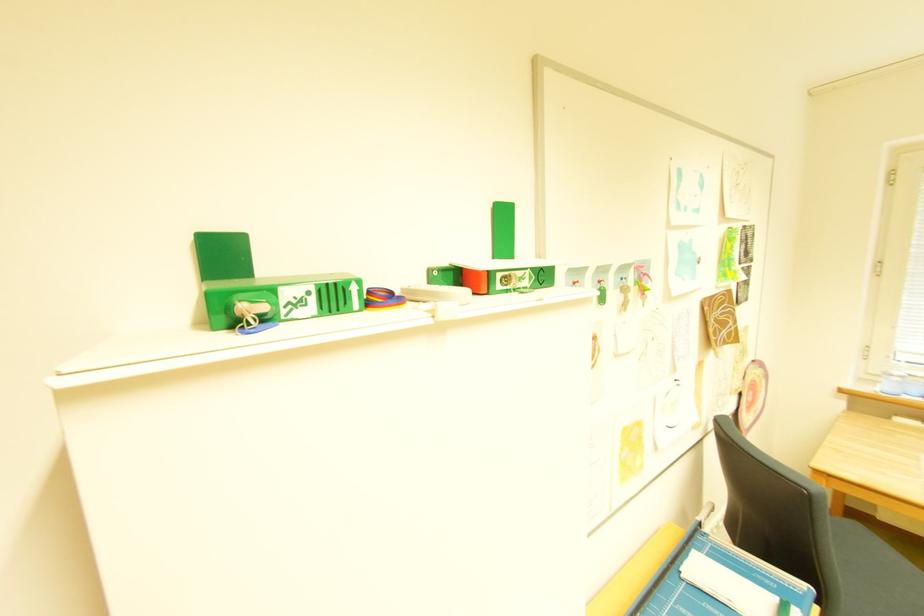
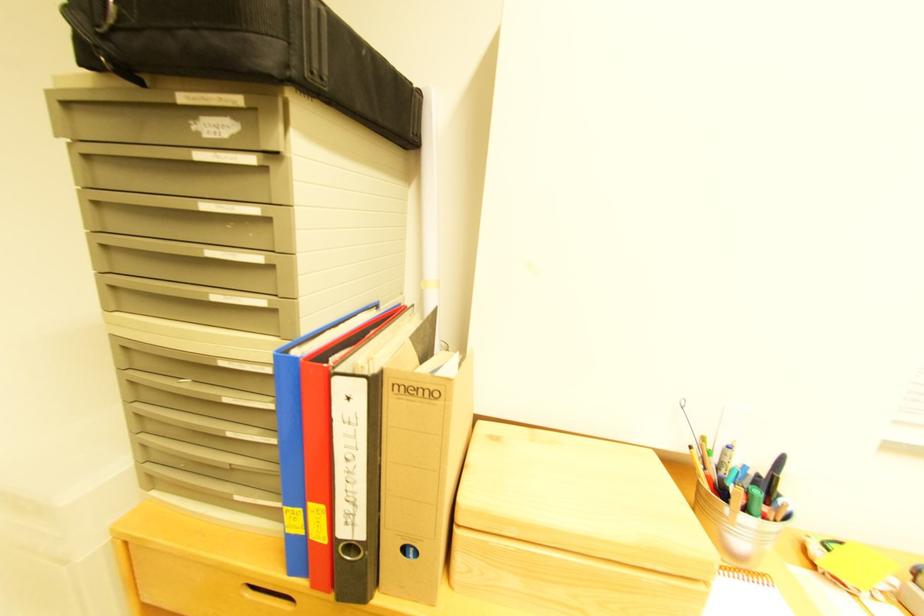
Question: How did the camera likely rotate?

Choices:
 (A) Left
 (B) Right
 (C) Up
 (D) Down

Answer: (A)